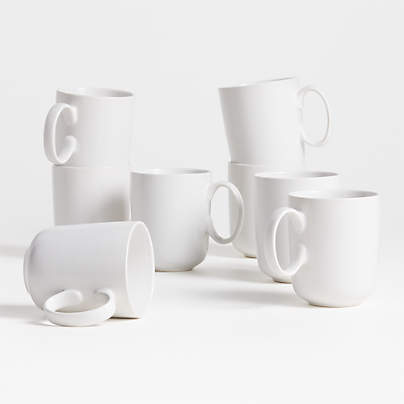
Find the location of a particular element. This screenshot has height=404, width=404. mugs is located at coordinates (83, 247), (85, 193), (92, 142), (163, 214), (268, 128), (241, 174), (272, 188), (341, 240).